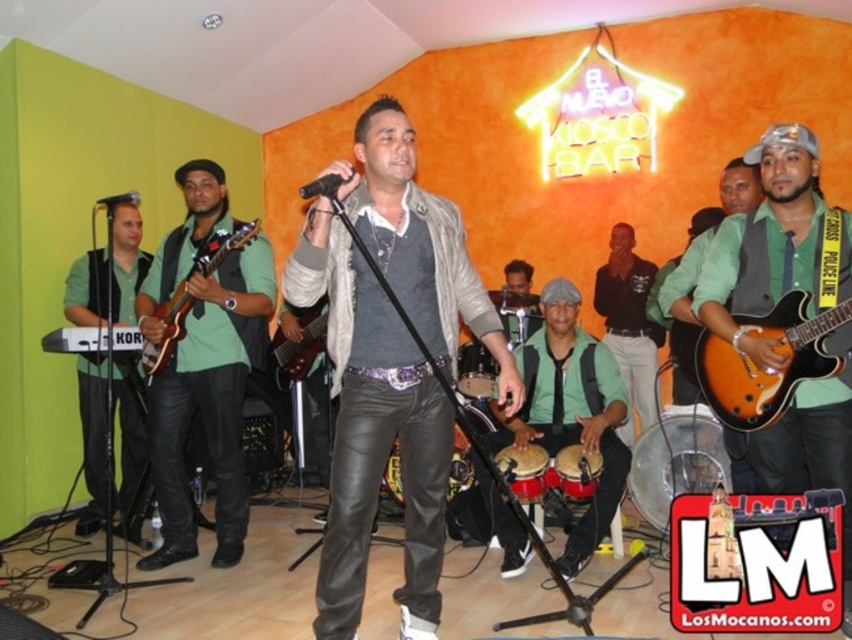
You are a photographer at El Nuevo Kiosco Bar. You want to capture a photo of the leather pants at center and orange glossy electric guitar at right. Which object is closer to the camera?

The leather pants at center is positioned under the orange glossy electric guitar at right, meaning the leather pants at center is closer to the camera since it is below the guitar.

You are a stagehand at El Nuevo Kiosco Bar and need to place a 6.5 feet long ladder to reach the neon sign on the orange wall. The orange glossy electric guitar at right is in your way. Can you safely place the ladder without hitting the guitar?

The orange glossy electric guitar at right is 8.31 feet away from the viewer. Since the ladder is 6.5 feet long, it can be placed safely without hitting the guitar as there is enough distance between them.